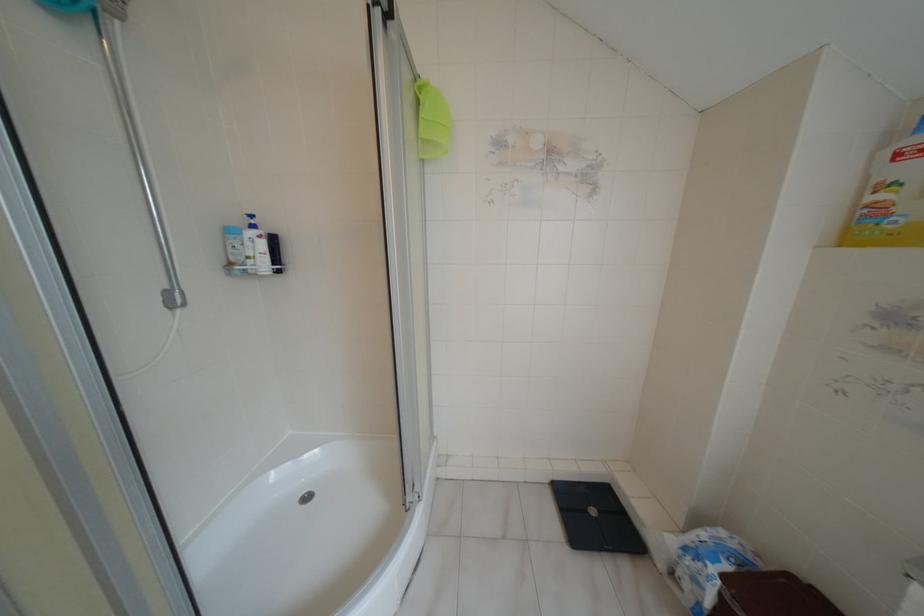
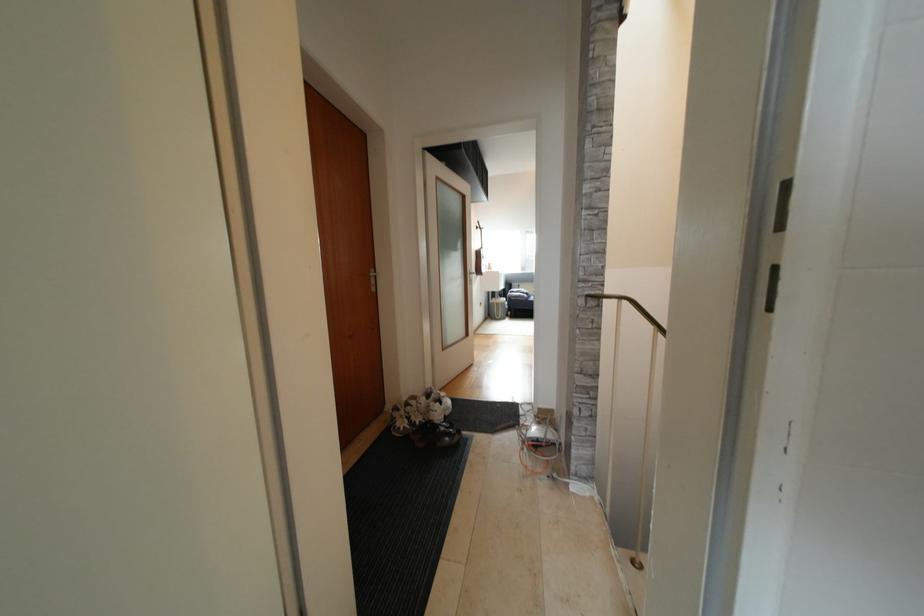
Question: The images are taken continuously from a first-person perspective. In which direction is your viewpoint rotating?

Choices:
 (A) Left
 (B) Right
 (C) Up
 (D) Down

Answer: (A)